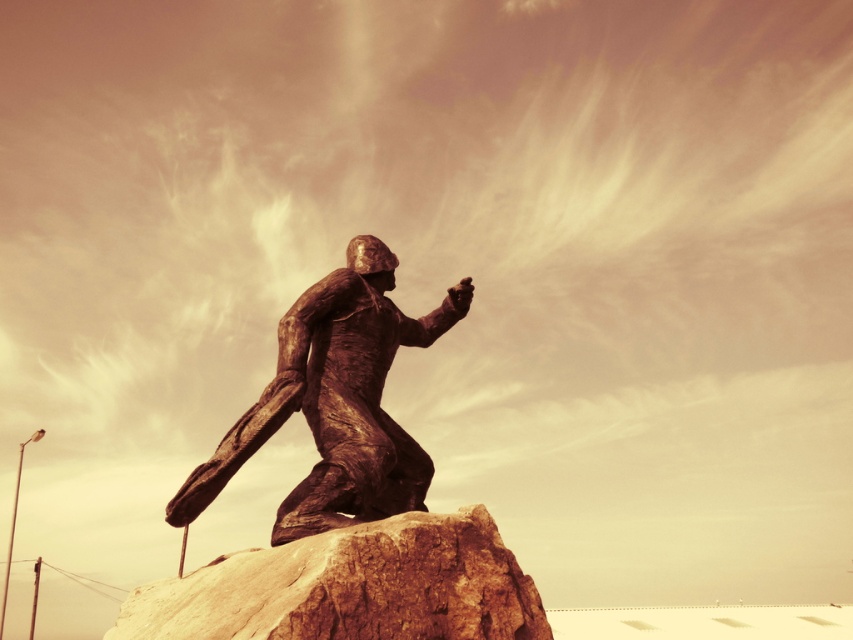
You are a sculptor planning to move the bronze statue at center to a new location. However, you need to ensure that the rusty stone boulder at center can support the statue. Given that the boulder is smaller than the statue, what should you consider before moving the statue?

The rusty stone boulder at center is smaller than the bronze statue at center, so you should consider whether the boulder can provide sufficient stability and support for the statue, as its size may not be adequate to hold the statue securely.

You are standing at the base of the statue and want to place a commemorative plaque on the ground. The plaque must be placed exactly at point (351, 588). However, there is an object there. What is the object blocking the plaque placement?

The object blocking the plaque placement at point (351, 588) is the rusty stone boulder at center.